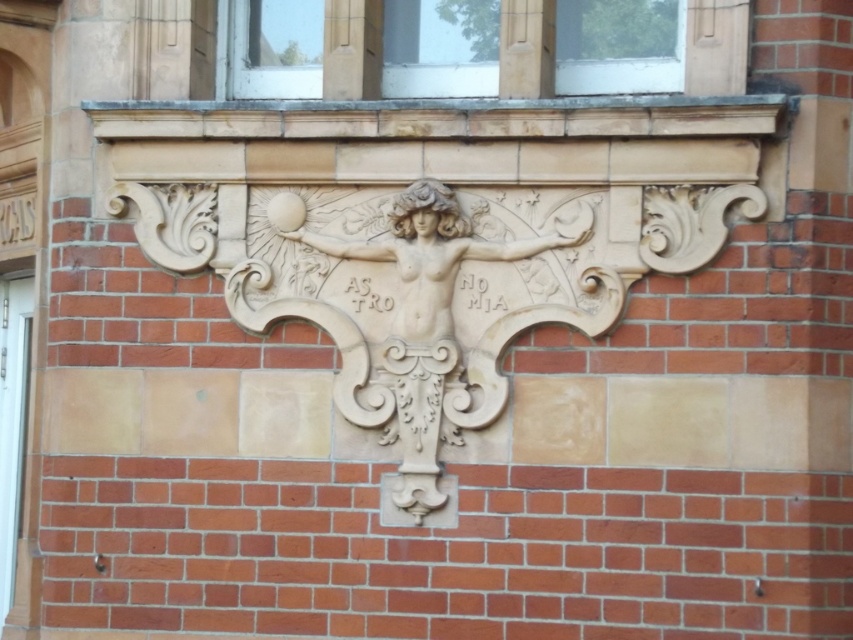
Question: Can you confirm if white stone relief at center is thinner than white stone writing at center?

Choices:
 (A) no
 (B) yes

Answer: (A)

Question: Which object appears farthest from the camera in this image?

Choices:
 (A) white stone writing at center
 (B) white stone relief at center
 (C) matte glass window at upper center

Answer: (A)

Question: Which object appears farthest from the camera in this image?

Choices:
 (A) white stone writing at center
 (B) white stone relief at center

Answer: (A)

Question: Can you confirm if white stone relief at center is wider than white stone writing at center?

Choices:
 (A) no
 (B) yes

Answer: (B)

Question: Is white stone relief at center to the right of matte glass window at upper center from the viewer's perspective?

Choices:
 (A) no
 (B) yes

Answer: (A)

Question: Which of these objects is positioned closest to the white stone relief at center?

Choices:
 (A) white stone writing at center
 (B) matte glass window at upper center

Answer: (A)